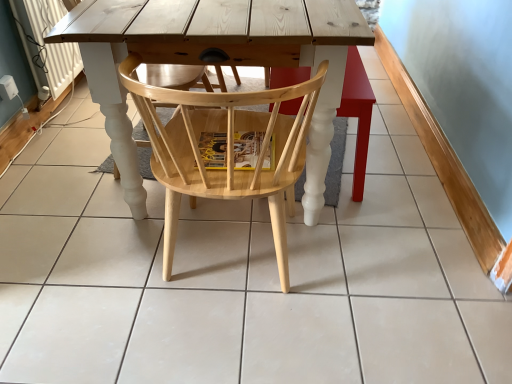
This screenshot has width=512, height=384. Identify the location of free spot in front of natural wood chair at center. (229, 355).